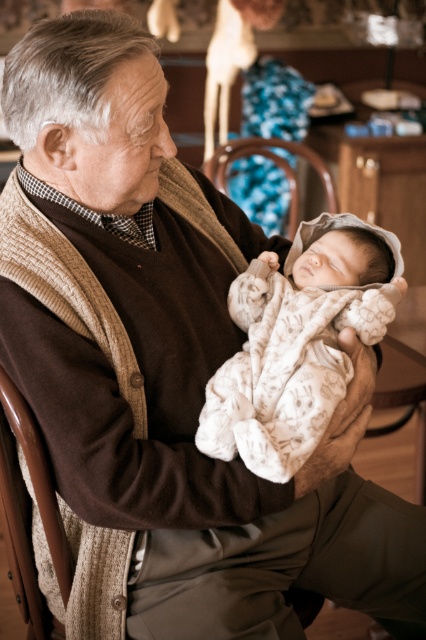
Question: Which point is closer to the camera?

Choices:
 (A) wooden chair at center
 (B) white soft fabric newborn at center

Answer: (B)

Question: Can you confirm if white soft fabric newborn at center is positioned below wooden chair at center?

Choices:
 (A) yes
 (B) no

Answer: (A)

Question: Observing the image, what is the correct spatial positioning of white soft fabric newborn at center in reference to wooden chair at center?

Choices:
 (A) left
 (B) right

Answer: (A)

Question: Which point appears farthest from the camera in this image?

Choices:
 (A) (374, 328)
 (B) (218, 177)

Answer: (B)

Question: Observing the image, what is the correct spatial positioning of white soft fabric newborn at center in reference to wooden chair at center?

Choices:
 (A) above
 (B) below

Answer: (B)